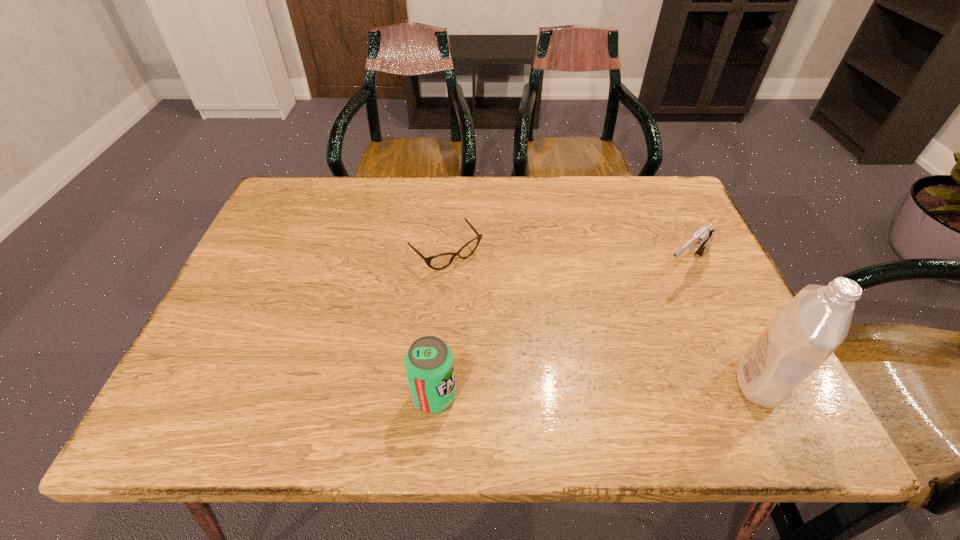
At what (x,y) coordinates should I click in order to perform the action: click on pop soda. Please return your answer as a coordinate pair (x, y). The width and height of the screenshot is (960, 540). Looking at the image, I should click on (429, 364).

The image size is (960, 540). Find the location of `the tallest object`. the tallest object is located at coordinates (816, 321).

This screenshot has height=540, width=960. I want to click on spectacles, so click(440, 261).

The width and height of the screenshot is (960, 540). I want to click on the third tallest object, so click(700, 242).

Locate an element on the screen. This screenshot has width=960, height=540. vacant space located 0.360m on the back of the tallest object is located at coordinates (688, 238).

Identify the location of free space located on the front-facing side of the shortest object. Image resolution: width=960 pixels, height=540 pixels. (482, 290).

Where is `free location located 0.240m on the front-facing side of the shortest object`? free location located 0.240m on the front-facing side of the shortest object is located at coordinates (527, 339).

Where is `vacant area situated on the front-facing side of the shortest object`? Image resolution: width=960 pixels, height=540 pixels. vacant area situated on the front-facing side of the shortest object is located at coordinates (565, 380).

This screenshot has width=960, height=540. Identify the location of vacant space located 0.390m at the muzzle of the gun. (563, 380).

I want to click on free space located 0.160m at the muzzle of the gun, so (x=629, y=317).